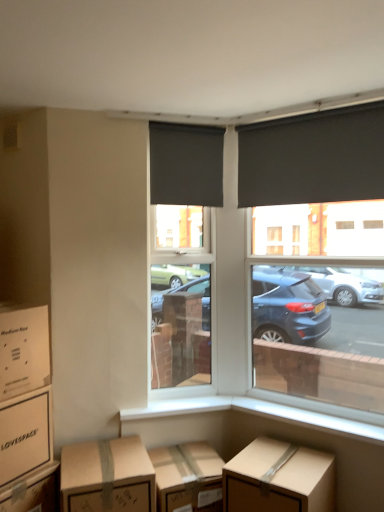
Image resolution: width=384 pixels, height=512 pixels. What are the coordinates of `brown cardboard box at lower center, which ranks as the fifth box in left-to-right order` in the screenshot? It's located at (279, 479).

What do you see at coordinates (317, 253) in the screenshot?
I see `black roller blind at upper right` at bounding box center [317, 253].

What do you see at coordinates (313, 157) in the screenshot?
I see `matte black roller blind at upper right, which is counted as the second window blind, starting from the left` at bounding box center [313, 157].

Based on the photo, how much space does brown cardboard box at lower left, positioned as the 3th box in left-to-right order, occupy vertically?

It is 43.46 centimeters.

What do you see at coordinates (34, 492) in the screenshot? I see `brown cardboard box at lower left, positioned as the 3th box in left-to-right order` at bounding box center [34, 492].

The height and width of the screenshot is (512, 384). I want to click on matte brown cardboard box at lower left, the second box viewed from the left, so click(x=25, y=435).

In order to click on matte black roller blind at upper left, the first window blind when ordered from left to right in this screenshot , I will do `click(186, 164)`.

Is point (307, 412) less distant than point (268, 170)?

Yes, it is.

Which object is closer to the camera taking this photo, white smooth window sill at lower center or matte black roller blind at upper right, which is counted as the second window blind, starting from the left?

white smooth window sill at lower center is more forward.

Is white smooth window sill at lower center bigger than matte black roller blind at upper right, which is counted as the second window blind, starting from the left?

Incorrect, white smooth window sill at lower center is not larger than matte black roller blind at upper right, which is counted as the second window blind, starting from the left.

Can you tell me how much white smooth window sill at lower center and matte black roller blind at upper right, which is counted as the second window blind, starting from the left, differ in facing direction?

white smooth window sill at lower center and matte black roller blind at upper right, which is counted as the second window blind, starting from the left, are facing 0.654 degrees away from each other.

Identify the location of cardboard box that appears in front of the black roller blind at upper right. (188, 477).

Does brown cardboard box at lower center have a larger size compared to black roller blind at upper right?

Incorrect, brown cardboard box at lower center is not larger than black roller blind at upper right.

Considering the sizes of objects brown cardboard box at lower center and black roller blind at upper right in the image provided, who is thinner, brown cardboard box at lower center or black roller blind at upper right?

black roller blind at upper right is thinner.

Considering the sizes of objects brown cardboard box at lower center and black roller blind at upper right in the image provided, who is shorter, brown cardboard box at lower center or black roller blind at upper right?

brown cardboard box at lower center.

Is matte black roller blind at upper left, the first window blind when ordered from left to right, positioned beyond the bounds of matte black roller blind at center?

Indeed, matte black roller blind at upper left, the first window blind when ordered from left to right, is completely outside matte black roller blind at center.

This screenshot has height=512, width=384. In order to click on window screen below the matte black roller blind at upper left, acting as the 2th window blind starting from the right (from the image's perspective) in this screenshot , I will do `click(183, 249)`.

Considering the positions of points (161, 173) and (186, 258), is point (161, 173) farther from camera compared to point (186, 258)?

No, (161, 173) is in front of (186, 258).

Which object is closer to the camera taking this photo, matte black roller blind at upper left, acting as the 2th window blind starting from the right, or matte black roller blind at center?

matte black roller blind at upper left, acting as the 2th window blind starting from the right.

In the scene shown: Could matte black roller blind at center be considered to be inside white smooth window sill at lower center?

No, matte black roller blind at center is not surrounded by white smooth window sill at lower center.

Which of these two, white smooth window sill at lower center or matte black roller blind at center, is smaller?

white smooth window sill at lower center.

Can you tell me how much white smooth window sill at lower center and matte black roller blind at center differ in facing direction?

The angular difference between white smooth window sill at lower center and matte black roller blind at center is 50.1 degrees.

Considering the sizes of brown cardboard box at lower left, positioned as the 3th box in left-to-right order, and white smooth window sill at lower center in the image, is brown cardboard box at lower left, positioned as the 3th box in left-to-right order, taller or shorter than white smooth window sill at lower center?

Considering their sizes, brown cardboard box at lower left, positioned as the 3th box in left-to-right order, has more height than white smooth window sill at lower center.

Considering the relative sizes of brown cardboard box at lower left, positioned as the 3th box in left-to-right order, and white smooth window sill at lower center in the image provided, is brown cardboard box at lower left, positioned as the 3th box in left-to-right order, bigger than white smooth window sill at lower center?

Yes, brown cardboard box at lower left, positioned as the 3th box in left-to-right order, is bigger than white smooth window sill at lower center.

Which of these two, brown cardboard box at lower left, positioned as the 3th box in left-to-right order, or white smooth window sill at lower center, is thinner?

white smooth window sill at lower center is thinner.

Which object is further away from the camera taking this photo, brown cardboard box at lower left, acting as the third box starting from the right, or white smooth window sill at lower center?

white smooth window sill at lower center is behind.

Is brown cardboard box at lower left, acting as the third box starting from the right, taller than brown cardboard box at lower left, which is counted as the fourth box, starting from the left?

In fact, brown cardboard box at lower left, acting as the third box starting from the right, may be shorter than brown cardboard box at lower left, which is counted as the fourth box, starting from the left.

Is brown cardboard box at lower left, positioned as the 3th box in left-to-right order, positioned before brown cardboard box at lower left, which is counted as the fourth box, starting from the left?

Yes, brown cardboard box at lower left, positioned as the 3th box in left-to-right order, is in front of brown cardboard box at lower left, which is counted as the fourth box, starting from the left.

Is brown cardboard box at lower left, acting as the third box starting from the right, oriented towards brown cardboard box at lower left, the second box when ordered from right to left?

Yes, brown cardboard box at lower left, acting as the third box starting from the right, faces towards brown cardboard box at lower left, the second box when ordered from right to left.

In the scene shown: Is cardboard box at lower left, marked as the fifth box in a right-to-left arrangement, in front of or behind matte black roller blind at center in the image?

cardboard box at lower left, marked as the fifth box in a right-to-left arrangement, is in front of matte black roller blind at center.

Looking at this image, from a real-world perspective, which is physically above, cardboard box at lower left, the first box when ordered from left to right, or matte black roller blind at center?

In real-world perspective, matte black roller blind at center is above.

Considering the sizes of objects cardboard box at lower left, marked as the fifth box in a right-to-left arrangement, and matte black roller blind at center in the image provided, who is taller, cardboard box at lower left, marked as the fifth box in a right-to-left arrangement, or matte black roller blind at center?

matte black roller blind at center.

In the scene shown: Does cardboard box at lower left, the first box when ordered from left to right, have a greater width compared to matte black roller blind at center?

Yes.

From the image's perspective, count 2nd window blinds upward from the white smooth window sill at lower center and point to it. Please provide its 2D coordinates.

[(313, 157)]

I want to click on cardboard box below the black roller blind at upper right (from a real-world perspective), so click(188, 477).

Which object lies further to the anchor point brown cardboard box at lower left, which is counted as the fourth box, starting from the left, brown cardboard box at lower center, positioned as the first box in right-to-left order, or matte black roller blind at center?

Among the two, matte black roller blind at center is located further to brown cardboard box at lower left, which is counted as the fourth box, starting from the left.

Based on their spatial positions, is brown cardboard box at lower center or black roller blind at upper right further from matte black roller blind at upper left, acting as the 2th window blind starting from the right?

black roller blind at upper right is positioned further to the anchor matte black roller blind at upper left, acting as the 2th window blind starting from the right.

Looking at this image, considering their positions, is black roller blind at upper right positioned closer to matte brown cardboard box at lower left, the 4th box from the right, than white smooth window sill at lower center?

Based on the image, white smooth window sill at lower center appears to be nearer to matte brown cardboard box at lower left, the 4th box from the right.

From the image, which object appears to be farther from matte brown cardboard box at lower left, the 4th box from the right, brown cardboard box at lower center, positioned as the first box in right-to-left order, or white smooth window sill at lower center?

Based on the image, brown cardboard box at lower center, positioned as the first box in right-to-left order, appears to be further to matte brown cardboard box at lower left, the 4th box from the right.

Based on their spatial positions, is white smooth window sill at lower center or matte black roller blind at upper left, acting as the 2th window blind starting from the right, further from brown cardboard box at lower left, the second box when ordered from right to left?

matte black roller blind at upper left, acting as the 2th window blind starting from the right, lies further to brown cardboard box at lower left, the second box when ordered from right to left, than the other object.

When comparing their distances from black roller blind at upper right, does brown cardboard box at lower center, which ranks as the fifth box in left-to-right order, or matte black roller blind at center seem closer?

The object closer to black roller blind at upper right is matte black roller blind at center.

From the image, which object appears to be nearer to matte black roller blind at upper right, marked as the 1th window blind in a right-to-left arrangement, cardboard box at lower left, marked as the fifth box in a right-to-left arrangement, or black roller blind at upper right?

cardboard box at lower left, marked as the fifth box in a right-to-left arrangement, is closer to matte black roller blind at upper right, marked as the 1th window blind in a right-to-left arrangement.

When comparing their distances from matte black roller blind at upper right, marked as the 1th window blind in a right-to-left arrangement, does matte black roller blind at center or matte black roller blind at upper left, the first window blind when ordered from left to right, seem closer?

matte black roller blind at upper left, the first window blind when ordered from left to right, is closer to matte black roller blind at upper right, marked as the 1th window blind in a right-to-left arrangement.

In order to click on cardboard box located between brown cardboard box at lower left, acting as the third box starting from the right, and black roller blind at upper right in the left-right direction in this screenshot , I will do `click(188, 477)`.

This screenshot has height=512, width=384. Find the location of `window between matte black roller blind at upper left, acting as the 2th window blind starting from the right, and brown cardboard box at lower center, positioned as the first box in right-to-left order, in the up-down direction`. window between matte black roller blind at upper left, acting as the 2th window blind starting from the right, and brown cardboard box at lower center, positioned as the first box in right-to-left order, in the up-down direction is located at coordinates (317, 253).

Identify the location of window screen between matte black roller blind at upper left, acting as the 2th window blind starting from the right, and brown cardboard box at lower center, in the vertical direction. Image resolution: width=384 pixels, height=512 pixels. (183, 249).

Locate an element on the screen. This screenshot has width=384, height=512. window sill between matte brown cardboard box at lower left, the 4th box from the right, and matte black roller blind at upper right, marked as the 1th window blind in a right-to-left arrangement, from left to right is located at coordinates (265, 413).